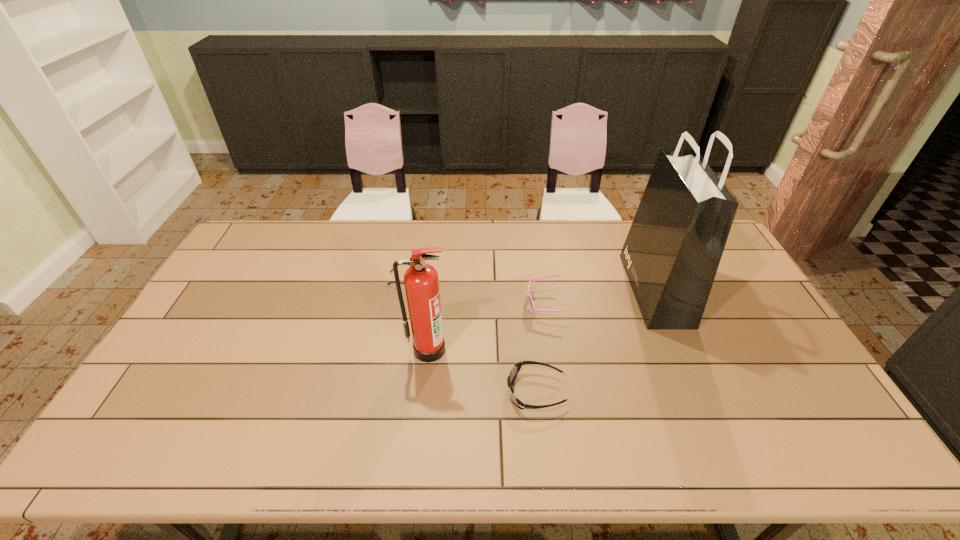
This screenshot has height=540, width=960. I want to click on vacant space situated on the front with handles of the tallest object, so click(x=526, y=289).

In order to click on vacant point located with the nozzle pointing from the back of the fire extinguisher in this screenshot , I will do `click(422, 404)`.

Where is `free space located on the front-facing side of the third tallest object`? The width and height of the screenshot is (960, 540). free space located on the front-facing side of the third tallest object is located at coordinates (469, 304).

Where is `free point located 0.060m on the front-facing side of the third tallest object`? Image resolution: width=960 pixels, height=540 pixels. free point located 0.060m on the front-facing side of the third tallest object is located at coordinates (508, 304).

The width and height of the screenshot is (960, 540). I want to click on vacant region located 0.220m on the front-facing side of the third tallest object, so click(x=457, y=304).

Locate an element on the screen. This screenshot has width=960, height=540. vacant region located on the lenses of the nearest object is located at coordinates (400, 392).

The image size is (960, 540). What are the coordinates of `free space located 0.140m on the lenses of the nearest object` in the screenshot? It's located at (453, 392).

Where is `vacant position located 0.240m on the lenses of the nearest object`? This screenshot has height=540, width=960. vacant position located 0.240m on the lenses of the nearest object is located at coordinates (416, 392).

This screenshot has height=540, width=960. Identify the location of free space located 0.120m on the lenses of the shortest object. click(458, 279).

Identify the location of object that is at the far edge. (671, 255).